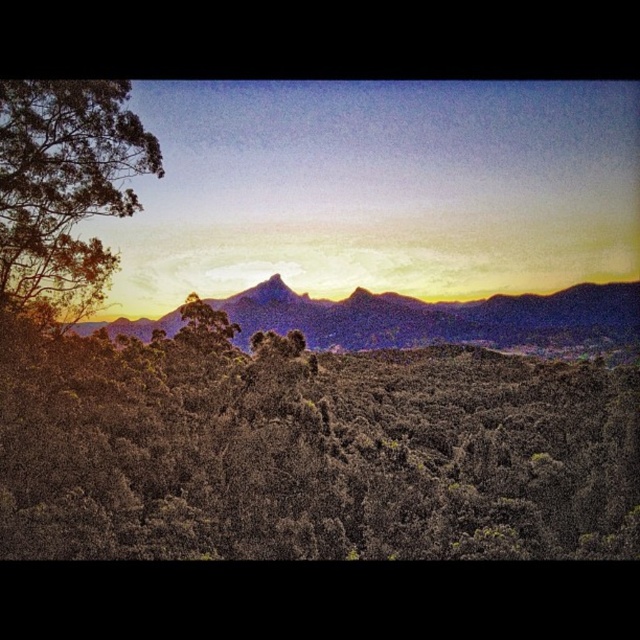
Does green leafy tree at left have a greater width compared to rugged purple mountain range at center?

In fact, green leafy tree at left might be narrower than rugged purple mountain range at center.

Can you confirm if green leafy tree at left is positioned to the left of rugged purple mountain range at center?

Yes, green leafy tree at left is to the left of rugged purple mountain range at center.

I want to click on green leafy tree at left, so click(65, 186).